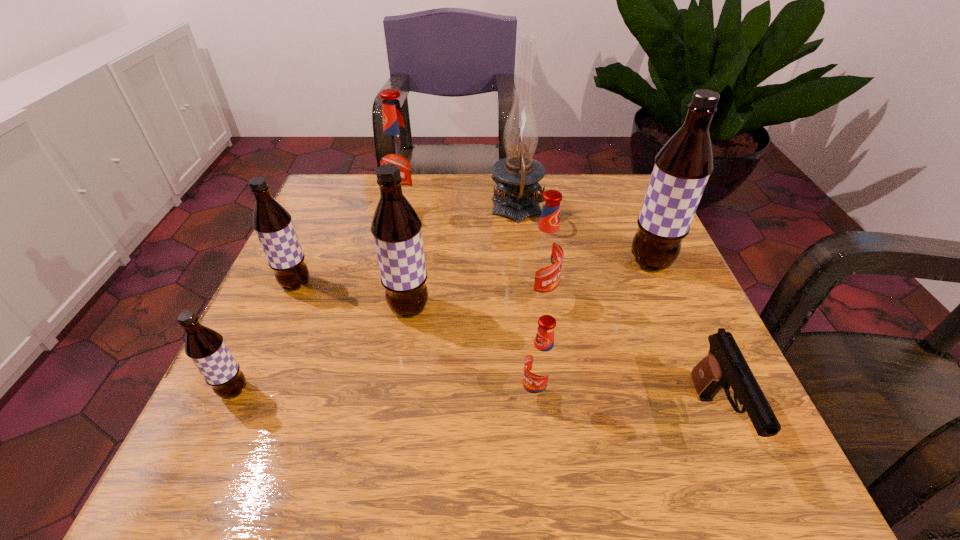
Identify the location of free location that satisfies the following two spatial constraints: 1. on the back side of the oil lamp; 2. on the left side of the farthest root beer. (407, 211).